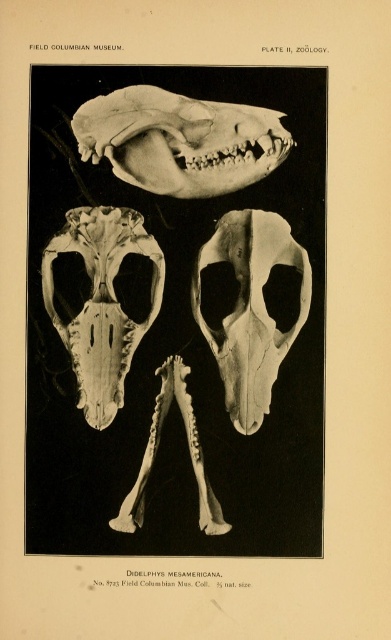
You are an anthropologist trying to measure the spacing between the two translucent bone skulls in the illustration. Given that your ruler can only measure up to 6 inches, will you be able to accurately measure the distance between the translucent bone skull at upper center and the translucent bone skull at center?

The distance between the translucent bone skull at upper center and the translucent bone skull at center is 6.79 inches, which exceeds your ruler measurement limit of 6 inches. Therefore, you cannot accurately measure the distance between the translucent bone skull at upper center and the translucent bone skull at center with your current ruler.

Looking at the image of the Didelphis mesamericana skull illustration, there are two skulls visible. The translucent bone skull at upper center and the white bone skull at center. Which of these two skulls is larger in size?

The translucent bone skull at upper center is bigger than the white bone skull at center.